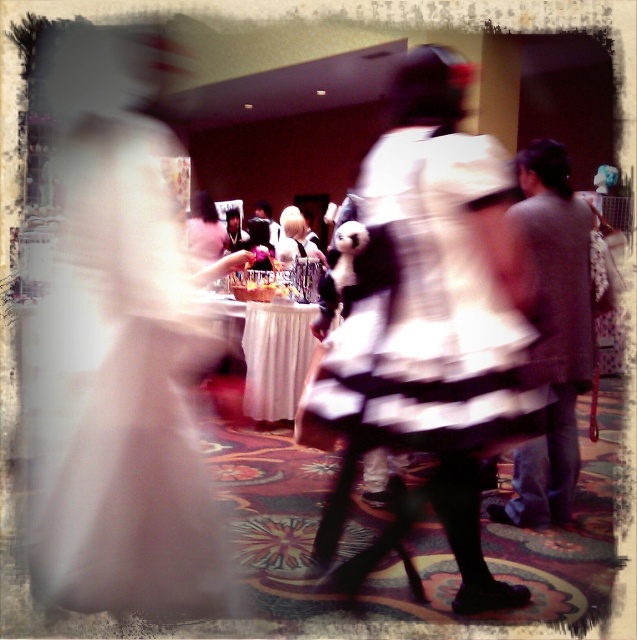
You are a photographer standing at the camera position. You want to take a clearer photo of the white striped dress at center. The current image is blurry because the subject moved too quickly. What is the minimum distance you should move closer to or farther away from the camera to ensure the subject is in focus?

The white striped dress at center is currently 5.84 feet away from the camera. To ensure the subject is in focus, you should move closer to the subject so that the distance between the camera and the white striped dress at center is within the camera focus range. However, the exact distance adjustment depends on the camera settings and lens capabilities, but reducing the distance might help achieve a clearer image.

You are a photographer at a wedding reception and need to adjust the lighting for the bride in the white satin dress at left and another guest in the white striped dress at center. Since the dresses are both white, you want to ensure the lighting highlights their positions. Based on their positions, which dress should you focus on first to ensure proper exposure?

The white satin dress at left is closer to the viewer than the white striped dress at center, so you should focus on the white satin dress at left first to ensure proper exposure since it is nearer and requires adjustment for clarity.

You are at the point labeled point [562,348] and want to see the point labeled point [399,339]. Is there a clear line of sight between you and the other point?

Yes, because point [399,339] is in front of point [562,348], so there is a clear line of sight between them.